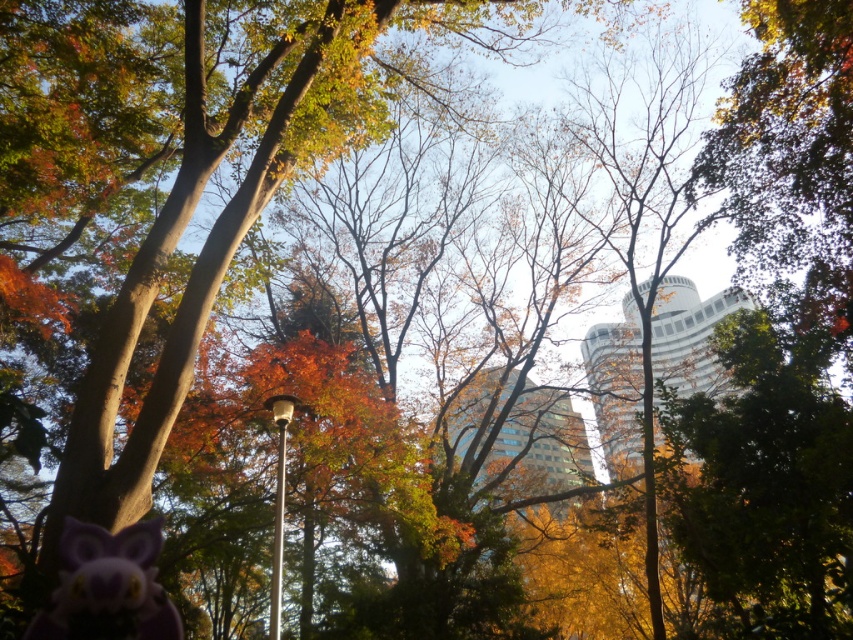
Is white glossy tower at center bigger than glassy blue skyscraper at center?

Yes.

Does white glossy tower at center have a smaller size compared to glassy blue skyscraper at center?

No, white glossy tower at center is not smaller than glassy blue skyscraper at center.

Image resolution: width=853 pixels, height=640 pixels. I want to click on white glossy tower at center, so click(x=616, y=387).

At what (x,y) coordinates should I click in order to perform the action: click on white glossy tower at center. Please return your answer as a coordinate pair (x, y). Looking at the image, I should click on (616, 387).